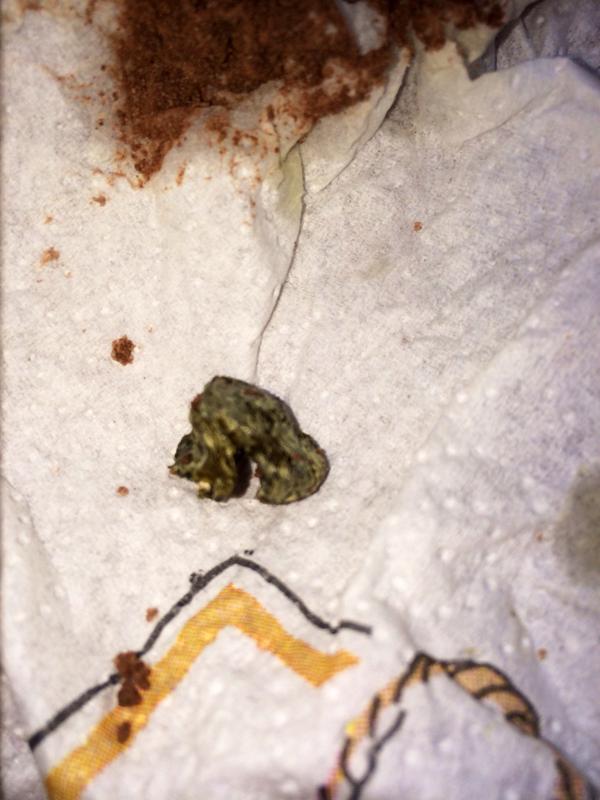
Identify the location of dirty towel. The width and height of the screenshot is (600, 800). (327, 336).